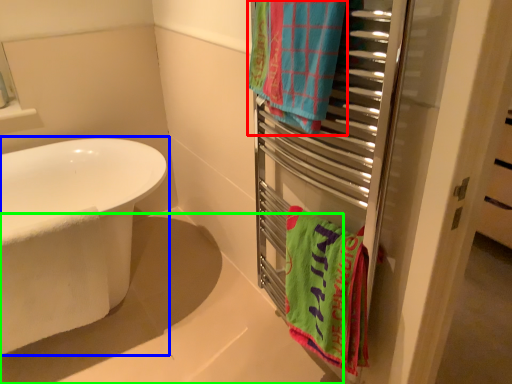
Question: Based on their relative distances, which object is nearer to towel/napkin (highlighted by a red box)? Choose from bathtub (highlighted by a blue box) and bath (highlighted by a green box).

Choices:
 (A) bathtub
 (B) bath

Answer: (A)